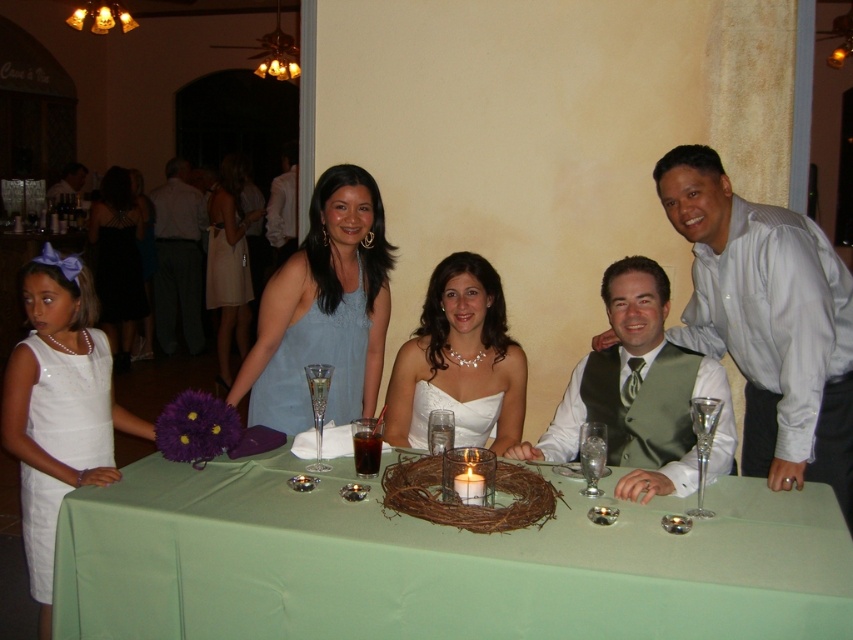
From the picture: Can you confirm if green satin vest at center is taller than white satin dress at upper center?

In fact, green satin vest at center may be shorter than white satin dress at upper center.

Does green satin vest at center have a greater width compared to white satin dress at upper center?

Yes, green satin vest at center is wider than white satin dress at upper center.

Who is more distant from viewer, [664,374] or [276,192]?

The point [276,192] is behind.

Locate an element on the screen. green satin vest at center is located at coordinates (640, 392).

Between gray fabric suit at left and light beige dress at center, which one has more height?

Standing taller between the two is light beige dress at center.

Does gray fabric suit at left have a smaller size compared to light beige dress at center?

Yes.

Which is in front, point (192, 289) or point (227, 294)?

Point (227, 294) is in front.

Where is `gray fabric suit at left`? This screenshot has height=640, width=853. gray fabric suit at left is located at coordinates (177, 257).

Which is more to the right, light blue shirt at upper right or green satin vest at center?

From the viewer's perspective, light blue shirt at upper right appears more on the right side.

Identify the location of light blue shirt at upper right. The image size is (853, 640). (769, 321).

Locate an element on the screen. This screenshot has height=640, width=853. light blue shirt at upper right is located at coordinates (769, 321).